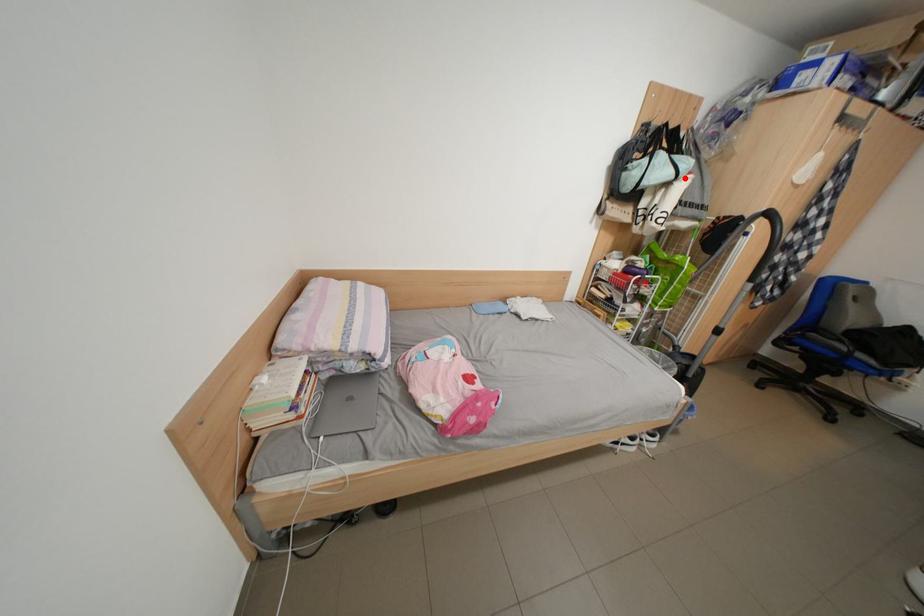
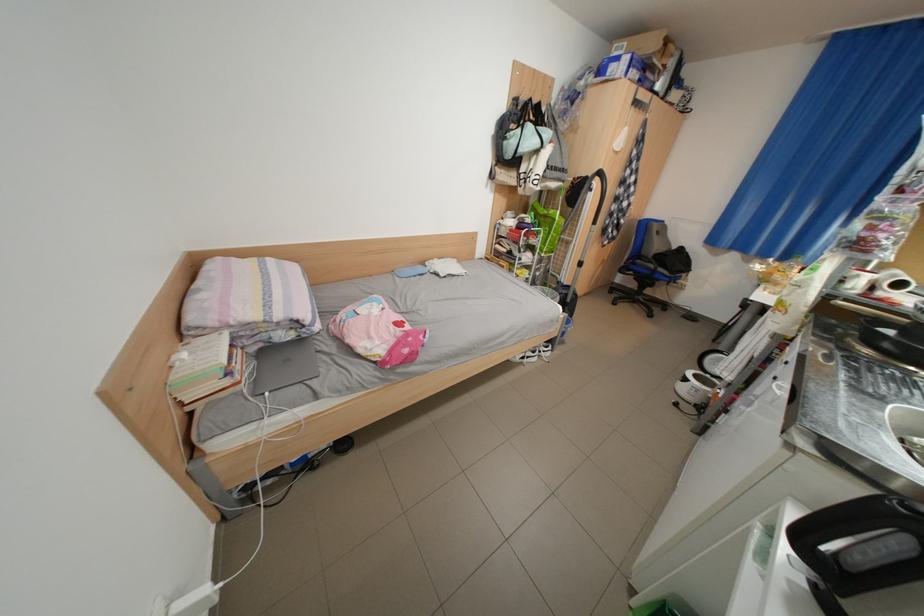
Question: I am providing you with two images of the same scene from different viewpoints. A red point is shown in image1. For the corresponding object point in image2, is it positioned nearer or farther from the camera?

Choices:
 (A) Nearer
 (B) Farther

Answer: (A)